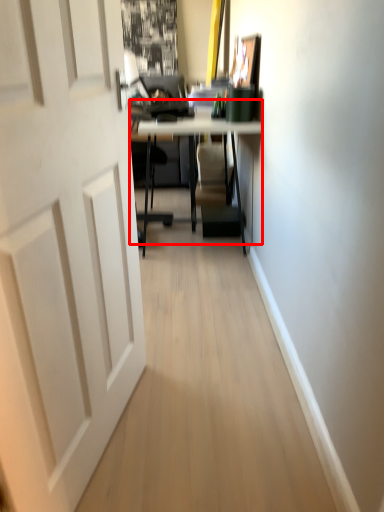
Question: From the image's perspective, considering the relative positions of table (annotated by the red box) and door in the image provided, where is table (annotated by the red box) located with respect to the staircase?

Choices:
 (A) above
 (B) below

Answer: (A)